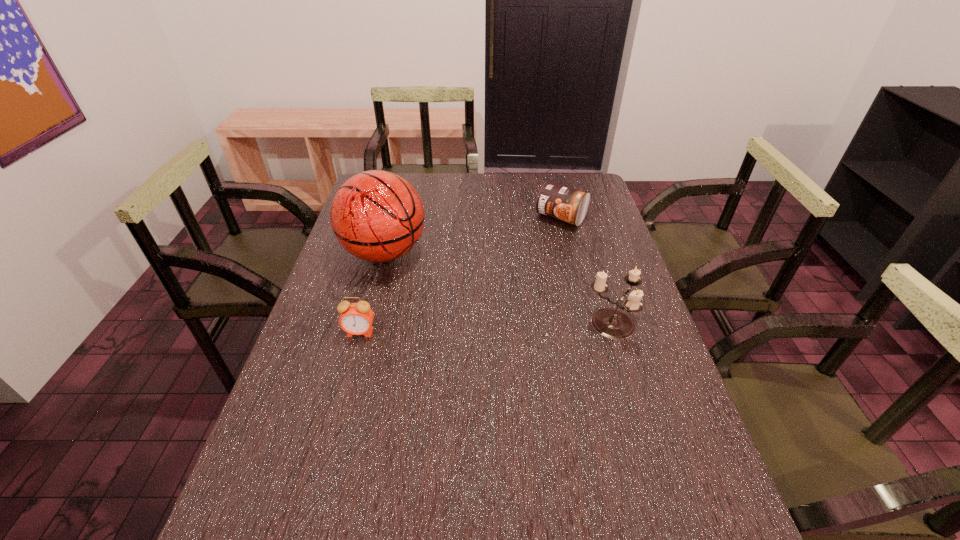
The height and width of the screenshot is (540, 960). I want to click on free space on the desktop that is between the alarm clock and the third shortest object and is positioned on the side with spill of the tallest object, so click(490, 329).

Find the location of a particular element. free spot on the desktop that is between the alarm clock and the candle holder and is positioned on the front label of the can is located at coordinates (459, 329).